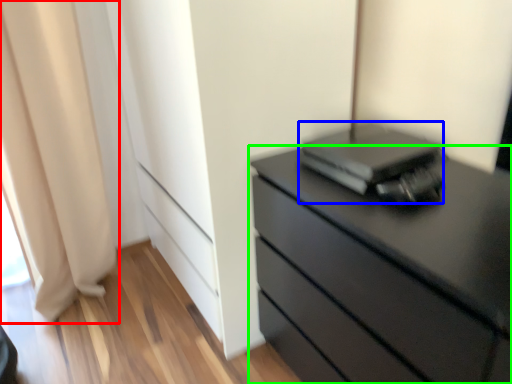
Question: Considering the real-world distances, which object is closest to curtain (highlighted by a red box)? computer (highlighted by a blue box) or chest of drawers (highlighted by a green box).

Choices:
 (A) computer
 (B) chest of drawers

Answer: (A)